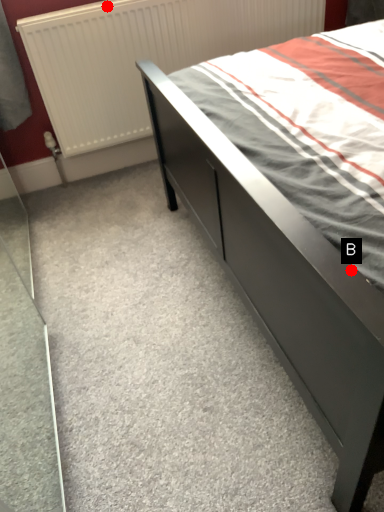
Question: Two points are circled on the image, labeled by A and B beside each circle. Which of the following is the farthest from the observer?

Choices:
 (A) A is further
 (B) B is further

Answer: (A)